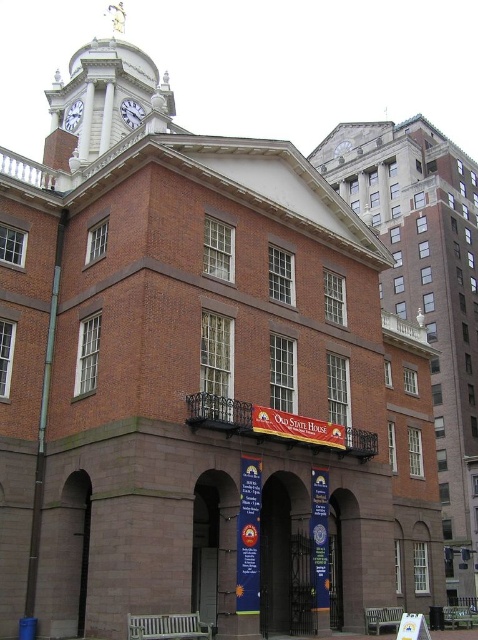
Is white metallic clock at upper center below white glossy clock at upper center?

No, white metallic clock at upper center is not below white glossy clock at upper center.

Measure the distance between white metallic clock at upper center and camera.

The distance of white metallic clock at upper center from camera is 225.43 feet.

Where is `white metallic clock at upper center`? The width and height of the screenshot is (478, 640). white metallic clock at upper center is located at coordinates (131, 113).

Is white marble clock tower at upper left below white metallic clock at upper center?

Incorrect, white marble clock tower at upper left is not positioned below white metallic clock at upper center.

Does white marble clock tower at upper left have a lesser width compared to white metallic clock at upper center?

Incorrect, white marble clock tower at upper left's width is not less than white metallic clock at upper center's.

This screenshot has height=640, width=478. What are the coordinates of `white marble clock tower at upper left` in the screenshot? It's located at (109, 97).

Measure the distance between white marble clock tower at upper left and camera.

A distance of 37.42 meters exists between white marble clock tower at upper left and camera.

This screenshot has height=640, width=478. I want to click on white marble clock tower at upper left, so click(x=109, y=97).

Describe the element at coordinates (109, 97) in the screenshot. I see `white marble clock tower at upper left` at that location.

Locate an element on the screen. This screenshot has height=640, width=478. white marble clock tower at upper left is located at coordinates (109, 97).